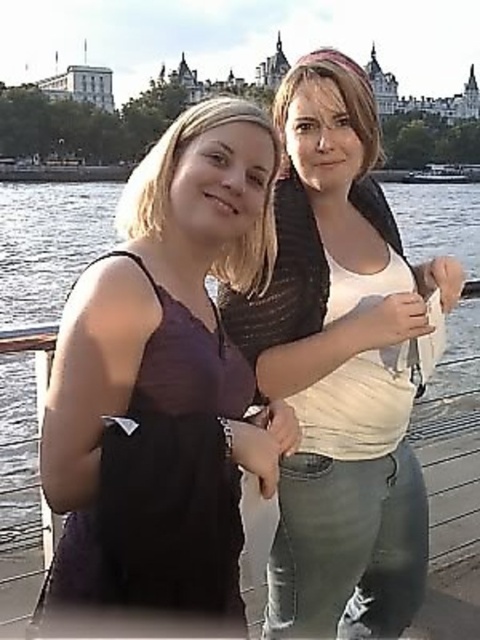
You are standing at the point closest to the camera in the image. There are two points marked in the scene, one at coordinates point (228,216) and the other at point (305,451). Which point are you currently standing at?

You are standing at point (228,216) because it is in front of point (305,451), making it closer to the camera.

You are a photographer trying to capture a group photo. You notice the purple matte tank top at left and the white matte shirt at center. Which clothing item appears narrower in the photo?

The purple matte tank top at left appears narrower than the white matte shirt at center because its width is less than the latter.